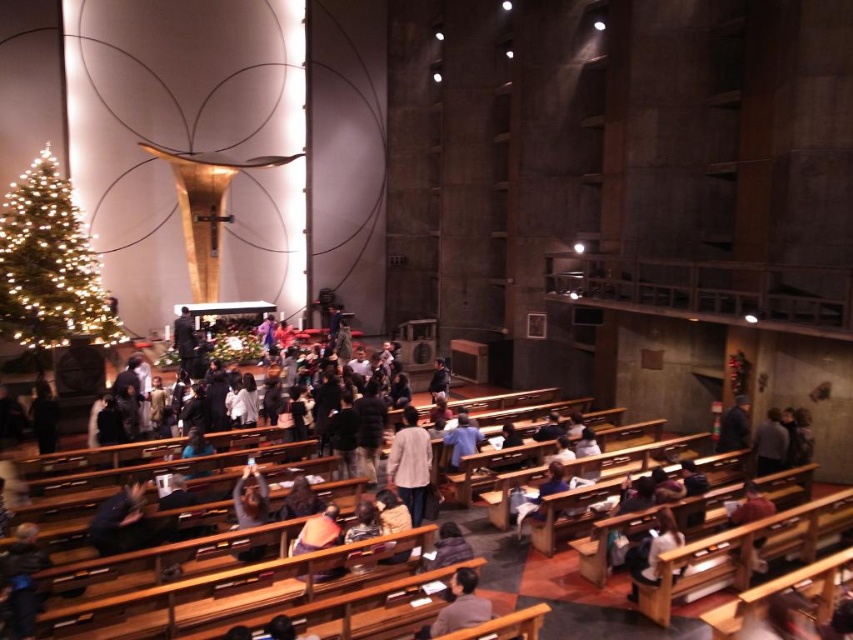
Question: Considering the real-world distances, which object is farthest from the dark blue shirt at center?

Choices:
 (A) green matte christmas tree at left
 (B) dark blue jacket at lower right
 (C) light brown wooden bench at lower right

Answer: (A)

Question: Does dark blue jacket at center appear on the right side of light brown wooden bench at lower right?

Choices:
 (A) yes
 (B) no

Answer: (B)

Question: Among these points, which one is farthest from the camera?

Choices:
 (A) (56, 304)
 (B) (102, 522)
 (C) (447, 632)

Answer: (A)

Question: Estimate the real-world distances between objects in this image. Which object is closer to the dark blue shirt at center?

Choices:
 (A) light brown wooden bench at lower center
 (B) dark blue jacket at center
 (C) dark gray sweater at lower right

Answer: (A)

Question: Is light gray sweater at center further to camera compared to dark brown leather jacket at center?

Choices:
 (A) no
 (B) yes

Answer: (B)

Question: Can you confirm if light brown wooden bench at lower right is wider than dark gray sweater at lower right?

Choices:
 (A) yes
 (B) no

Answer: (A)